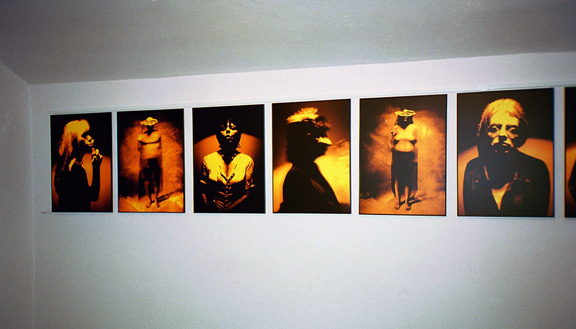
You are a GUI agent. You are given a task and a screenshot of the screen. Output one action in this format:
    pyautogui.click(x=<x>, y=<y>)
    Task: Click on the ceiling
    Image resolution: width=576 pixels, height=329 pixels.
    Given the screenshot: What is the action you would take?
    pyautogui.click(x=165, y=23)